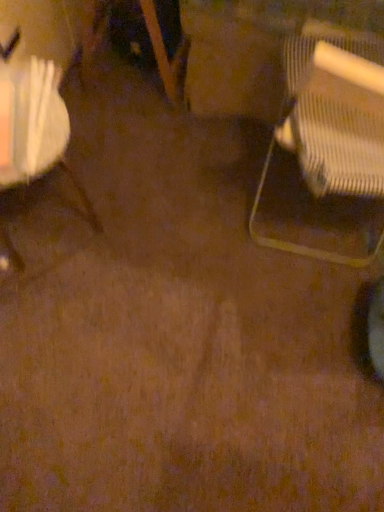
The height and width of the screenshot is (512, 384). Identify the location of white fabric bag at left, which is the first chair in left-to-right order. (34, 128).

The width and height of the screenshot is (384, 512). Describe the element at coordinates (34, 128) in the screenshot. I see `white fabric bag at left, which is the first chair in left-to-right order` at that location.

At what (x,y) coordinates should I click in order to perform the action: click on metallic mesh chair at right, placed as the second chair when sorted from left to right. Please return your answer as a coordinate pair (x, y). The image size is (384, 512). Looking at the image, I should click on (331, 128).

What do you see at coordinates (331, 128) in the screenshot?
I see `metallic mesh chair at right, arranged as the first chair when viewed from the right` at bounding box center [331, 128].

I want to click on white fabric bag at left, the second chair positioned from the right, so click(34, 128).

Can you confirm if white fabric bag at left, the second chair positioned from the right, is positioned to the left of metallic mesh chair at right, placed as the second chair when sorted from left to right?

Indeed, white fabric bag at left, the second chair positioned from the right, is positioned on the left side of metallic mesh chair at right, placed as the second chair when sorted from left to right.

Considering the positions of objects white fabric bag at left, the second chair positioned from the right, and metallic mesh chair at right, arranged as the first chair when viewed from the right, in the image provided, who is in front, white fabric bag at left, the second chair positioned from the right, or metallic mesh chair at right, arranged as the first chair when viewed from the right,?

metallic mesh chair at right, arranged as the first chair when viewed from the right, is in front.

Is point (14, 139) positioned behind point (343, 67)?

Yes, point (14, 139) is behind point (343, 67).

From the image's perspective, which one is positioned lower, white fabric bag at left, which is the first chair in left-to-right order, or metallic mesh chair at right, placed as the second chair when sorted from left to right?

From the image's view, white fabric bag at left, which is the first chair in left-to-right order, is below.

From a real-world perspective, is white fabric bag at left, the second chair positioned from the right, on metallic mesh chair at right, arranged as the first chair when viewed from the right?

Incorrect, from a real-world perspective, white fabric bag at left, the second chair positioned from the right, is lower than metallic mesh chair at right, arranged as the first chair when viewed from the right.

Between white fabric bag at left, which is the first chair in left-to-right order, and metallic mesh chair at right, arranged as the first chair when viewed from the right, which one has smaller width?

Thinner between the two is white fabric bag at left, which is the first chair in left-to-right order.

Who is shorter, white fabric bag at left, which is the first chair in left-to-right order, or metallic mesh chair at right, arranged as the first chair when viewed from the right?

Standing shorter between the two is white fabric bag at left, which is the first chair in left-to-right order.

Who is smaller, white fabric bag at left, the second chair positioned from the right, or metallic mesh chair at right, placed as the second chair when sorted from left to right?

With smaller size is white fabric bag at left, the second chair positioned from the right.

Is white fabric bag at left, the second chair positioned from the right, not within metallic mesh chair at right, arranged as the first chair when viewed from the right?

Yes, white fabric bag at left, the second chair positioned from the right, is located beyond the bounds of metallic mesh chair at right, arranged as the first chair when viewed from the right.

Is white fabric bag at left, the second chair positioned from the right, placed right next to metallic mesh chair at right, arranged as the first chair when viewed from the right?

white fabric bag at left, the second chair positioned from the right, and metallic mesh chair at right, arranged as the first chair when viewed from the right, are clearly separated.

Is white fabric bag at left, which is the first chair in left-to-right order, oriented away from metallic mesh chair at right, arranged as the first chair when viewed from the right?

No, white fabric bag at left, which is the first chair in left-to-right order,'s orientation is not away from metallic mesh chair at right, arranged as the first chair when viewed from the right.

Measure the distance from white fabric bag at left, which is the first chair in left-to-right order, to metallic mesh chair at right, placed as the second chair when sorted from left to right.

white fabric bag at left, which is the first chair in left-to-right order, is 23.28 inches from metallic mesh chair at right, placed as the second chair when sorted from left to right.

Where is `chair that appears above the white fabric bag at left, the second chair positioned from the right (from a real-world perspective)`? The width and height of the screenshot is (384, 512). chair that appears above the white fabric bag at left, the second chair positioned from the right (from a real-world perspective) is located at coordinates (331, 128).

Is metallic mesh chair at right, placed as the second chair when sorted from left to right, to the left of white fabric bag at left, the second chair positioned from the right, from the viewer's perspective?

In fact, metallic mesh chair at right, placed as the second chair when sorted from left to right, is to the right of white fabric bag at left, the second chair positioned from the right.

Is metallic mesh chair at right, placed as the second chair when sorted from left to right, closer to camera compared to white fabric bag at left, the second chair positioned from the right?

Yes, metallic mesh chair at right, placed as the second chair when sorted from left to right, is closer to the viewer.

Is point (304, 172) less distant than point (15, 85)?

Yes, it is in front of point (15, 85).

From the image's perspective, is metallic mesh chair at right, placed as the second chair when sorted from left to right, over white fabric bag at left, the second chair positioned from the right?

Yes.

Based on the photo, from a real-world perspective, is metallic mesh chair at right, placed as the second chair when sorted from left to right, located higher than white fabric bag at left, the second chair positioned from the right?

Yes, from a real-world perspective, metallic mesh chair at right, placed as the second chair when sorted from left to right, is above white fabric bag at left, the second chair positioned from the right.

Does metallic mesh chair at right, placed as the second chair when sorted from left to right, have a greater width compared to white fabric bag at left, which is the first chair in left-to-right order?

Correct, the width of metallic mesh chair at right, placed as the second chair when sorted from left to right, exceeds that of white fabric bag at left, which is the first chair in left-to-right order.

In terms of height, does metallic mesh chair at right, placed as the second chair when sorted from left to right, look taller or shorter compared to white fabric bag at left, the second chair positioned from the right?

In the image, metallic mesh chair at right, placed as the second chair when sorted from left to right, appears to be taller than white fabric bag at left, the second chair positioned from the right.

Which of these two, metallic mesh chair at right, arranged as the first chair when viewed from the right, or white fabric bag at left, the second chair positioned from the right, is smaller?

With smaller size is white fabric bag at left, the second chair positioned from the right.

Is metallic mesh chair at right, arranged as the first chair when viewed from the right, spatially inside white fabric bag at left, which is the first chair in left-to-right order, or outside of it?

metallic mesh chair at right, arranged as the first chair when viewed from the right, is outside white fabric bag at left, which is the first chair in left-to-right order.

From the picture: Is there a large distance between metallic mesh chair at right, arranged as the first chair when viewed from the right, and white fabric bag at left, the second chair positioned from the right?

No, metallic mesh chair at right, arranged as the first chair when viewed from the right, is not far away from white fabric bag at left, the second chair positioned from the right.

Is metallic mesh chair at right, arranged as the first chair when viewed from the right, oriented towards white fabric bag at left, the second chair positioned from the right?

No, metallic mesh chair at right, arranged as the first chair when viewed from the right, does not turn towards white fabric bag at left, the second chair positioned from the right.

Measure the distance from metallic mesh chair at right, arranged as the first chair when viewed from the right, to white fabric bag at left, the second chair positioned from the right.

metallic mesh chair at right, arranged as the first chair when viewed from the right, is 23.28 inches from white fabric bag at left, the second chair positioned from the right.

Where is `chair above the white fabric bag at left, the second chair positioned from the right (from a real-world perspective)`? Image resolution: width=384 pixels, height=512 pixels. chair above the white fabric bag at left, the second chair positioned from the right (from a real-world perspective) is located at coordinates (331, 128).

Image resolution: width=384 pixels, height=512 pixels. What are the coordinates of `chair above the white fabric bag at left, the second chair positioned from the right (from the image's perspective)` in the screenshot? It's located at (331, 128).

The width and height of the screenshot is (384, 512). I want to click on chair located behind the metallic mesh chair at right, arranged as the first chair when viewed from the right, so click(34, 128).